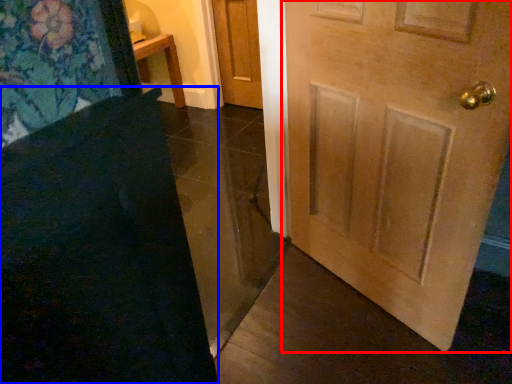
Question: Which object appears closest to the camera in this image, door (highlighted by a red box) or doormat (highlighted by a blue box)?

Choices:
 (A) door
 (B) doormat

Answer: (B)